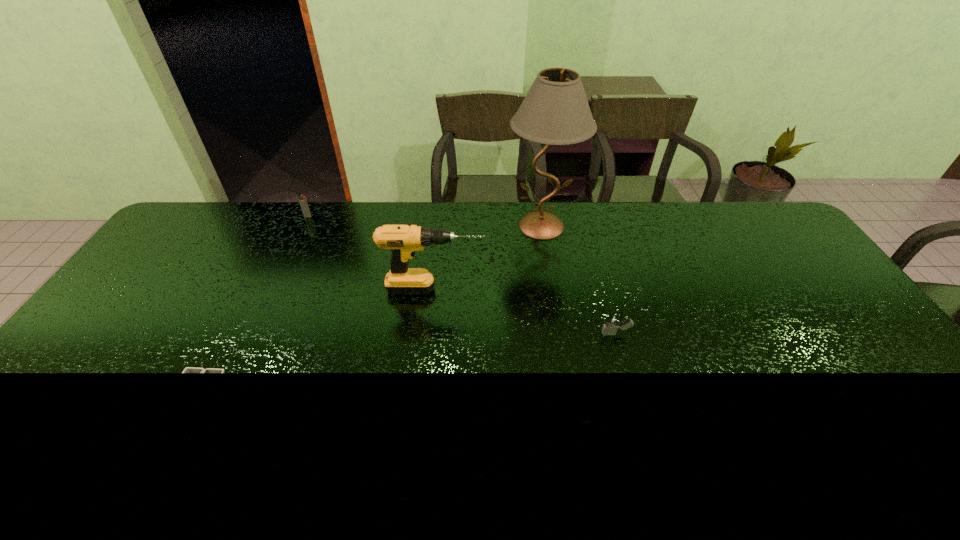
Where is `object that is the closest to the farther igniter`? This screenshot has height=540, width=960. object that is the closest to the farther igniter is located at coordinates (404, 240).

Identify which object is the third nearest to the right igniter. Please provide its 2D coordinates. Your answer should be formatted as a tuple, i.e. [(x, y)], where the tuple contains the x and y coordinates of a point satisfying the conditions above.

[(188, 369)]

Locate an element on the screen. The image size is (960, 540). vacant space that satisfies the following two spatial constraints: 1. on the back side of the ashtray; 2. on the right side of the farther igniter is located at coordinates (291, 217).

Locate an element on the screen. blank area in the image that satisfies the following two spatial constraints: 1. at the tip of the second tallest object; 2. on the front side of the shortest object is located at coordinates (423, 392).